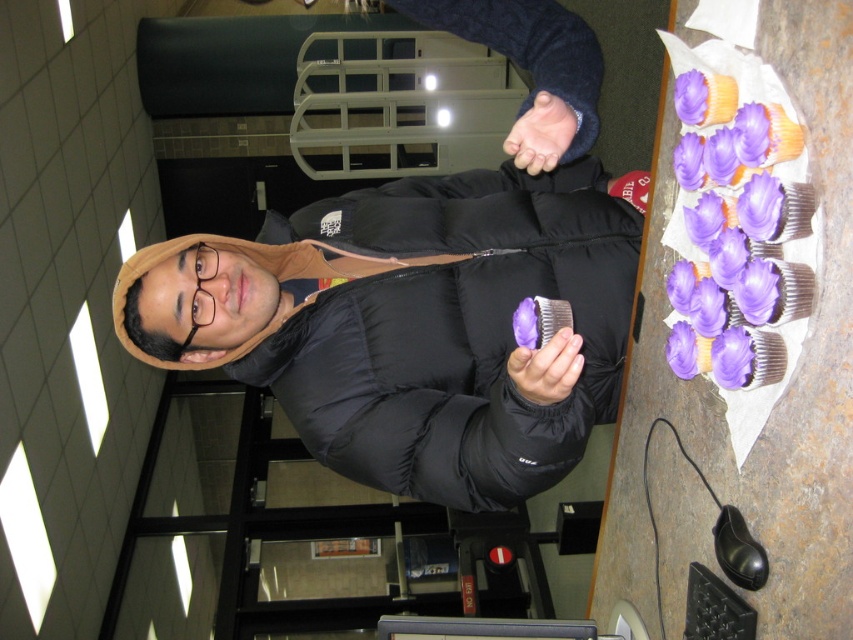
You are a security camera observing the scene. The person is holding a cupcake, but there is a hand near the cupcake tray. Is the purple matte hand at center closer to the cupcake tray than the purple matte cupcake at center?

The purple matte hand at center is to the right of the purple matte cupcake at center, so the hand is farther from the tray than the cupcake itself.

From the picture: You are a delivery robot with a height of 1.5 meters. You need to deliver a package to the black puffy jacket at center. Can you safely reach the person without bending down or adjusting your height?

The black puffy jacket at center and viewer are 1.09 meters apart from each other. Since the robot is 1.5 meters tall and the distance between them is less than the robot height, the robot can safely reach the person without needing to adjust its height.